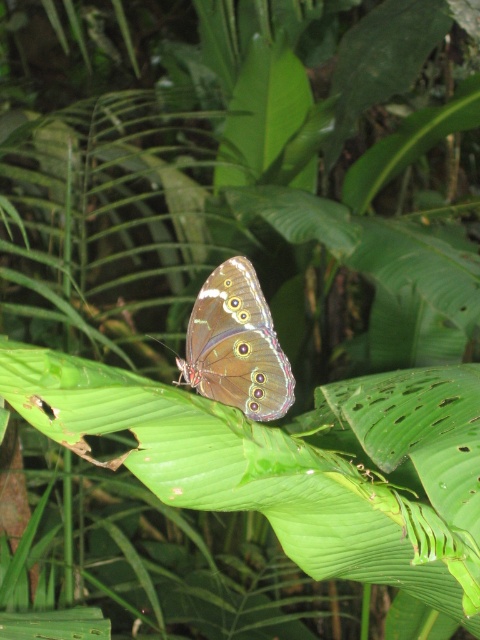
Question: Does green matte leaf at center lie behind brown iridescent butterfly at center?

Choices:
 (A) yes
 (B) no

Answer: (B)

Question: Can you confirm if green matte leaf at center is smaller than brown iridescent butterfly at center?

Choices:
 (A) no
 (B) yes

Answer: (A)

Question: Which point appears farthest from the camera in this image?

Choices:
 (A) pos(206,452)
 (B) pos(223,276)

Answer: (B)

Question: Is green matte leaf at center positioned at the back of brown iridescent butterfly at center?

Choices:
 (A) yes
 (B) no

Answer: (B)

Question: Which of the following is the closest to the observer?

Choices:
 (A) brown iridescent butterfly at center
 (B) green matte leaf at center

Answer: (B)